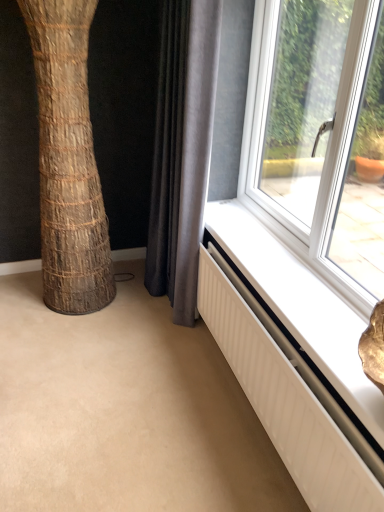
Question: Considering the relative sizes of white textured radiator at lower right and brown textured tree trunk at left in the image provided, is white textured radiator at lower right shorter than brown textured tree trunk at left?

Choices:
 (A) no
 (B) yes

Answer: (B)

Question: Is white textured radiator at lower right in front of brown textured tree trunk at left?

Choices:
 (A) no
 (B) yes

Answer: (B)

Question: Could you tell me if white textured radiator at lower right is facing brown textured tree trunk at left?

Choices:
 (A) yes
 (B) no

Answer: (B)

Question: From the image's perspective, is white textured radiator at lower right over brown textured tree trunk at left?

Choices:
 (A) yes
 (B) no

Answer: (B)

Question: Would you say brown textured tree trunk at left is part of white textured radiator at lower right's contents?

Choices:
 (A) no
 (B) yes

Answer: (A)

Question: Can you confirm if white textured radiator at lower right is positioned to the left of brown textured tree trunk at left?

Choices:
 (A) yes
 (B) no

Answer: (B)

Question: Could you tell me if gray fabric curtain at lower center is facing white textured radiator at lower right?

Choices:
 (A) yes
 (B) no

Answer: (B)

Question: Is gray fabric curtain at lower center behind white textured radiator at lower right?

Choices:
 (A) yes
 (B) no

Answer: (A)

Question: Are gray fabric curtain at lower center and white textured radiator at lower right located far from each other?

Choices:
 (A) no
 (B) yes

Answer: (A)

Question: Is gray fabric curtain at lower center at the left side of white textured radiator at lower right?

Choices:
 (A) no
 (B) yes

Answer: (B)

Question: Considering the relative sizes of gray fabric curtain at lower center and white textured radiator at lower right in the image provided, is gray fabric curtain at lower center shorter than white textured radiator at lower right?

Choices:
 (A) yes
 (B) no

Answer: (B)

Question: From a real-world perspective, is gray fabric curtain at lower center positioned over white textured radiator at lower right based on gravity?

Choices:
 (A) no
 (B) yes

Answer: (B)

Question: From a real-world perspective, is white textured radiator at lower right located higher than gray fabric curtain at lower center?

Choices:
 (A) yes
 (B) no

Answer: (B)